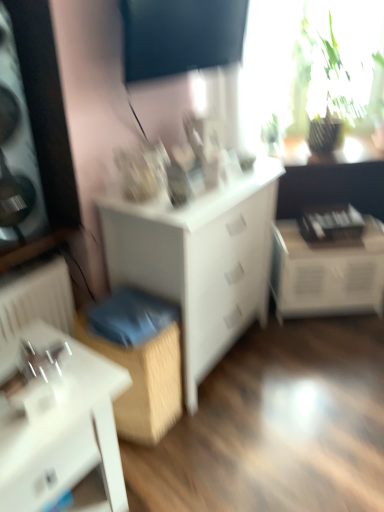
The width and height of the screenshot is (384, 512). In order to click on vacant space to the right of wooden box at lower center in this screenshot , I will do 206,418.